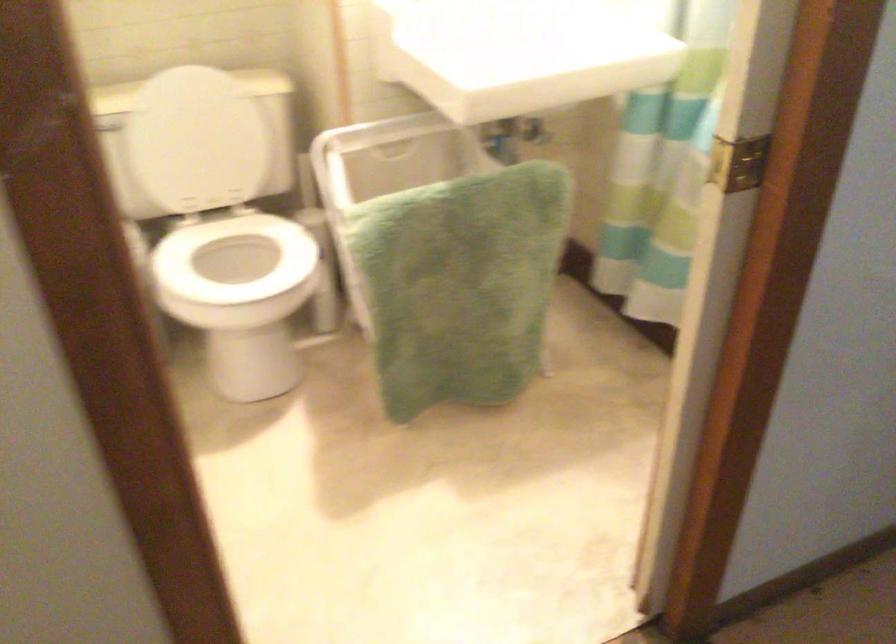
Image resolution: width=896 pixels, height=644 pixels. What do you see at coordinates (196, 140) in the screenshot?
I see `the white toilet lid` at bounding box center [196, 140].